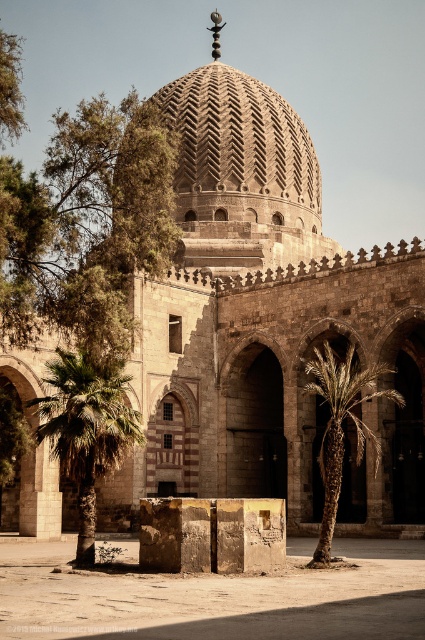
Does green leafy palm at lower left have a lesser width compared to green leafy palm tree at center?

Incorrect, green leafy palm at lower left's width is not less than green leafy palm tree at center's.

Does green leafy palm at lower left have a greater width compared to green leafy palm tree at center?

Indeed, green leafy palm at lower left has a greater width compared to green leafy palm tree at center.

Is point (87, 417) positioned in front of point (380, 369)?

That is True.

Where is `green leafy palm at lower left`? green leafy palm at lower left is located at coordinates (87, 432).

Between stone pillar at center and stone textured dome at center, which one has more height?

stone textured dome at center is taller.

Who is more distant from viewer, [127,628] or [212,74]?

Point [212,74]

Find the location of a particular element. The image size is (425, 640). stone pillar at center is located at coordinates (207, 595).

How distant is stone pillar at center from green leafy palm at lower left?

stone pillar at center and green leafy palm at lower left are 7.40 meters apart from each other.

Who is more distant from viewer, (268, 616) or (127, 440)?

The point (127, 440) is more distant.

Is point (422, 545) closer to viewer compared to point (110, 440)?

No, it is behind (110, 440).

Identify the location of stone pillar at center. (207, 595).